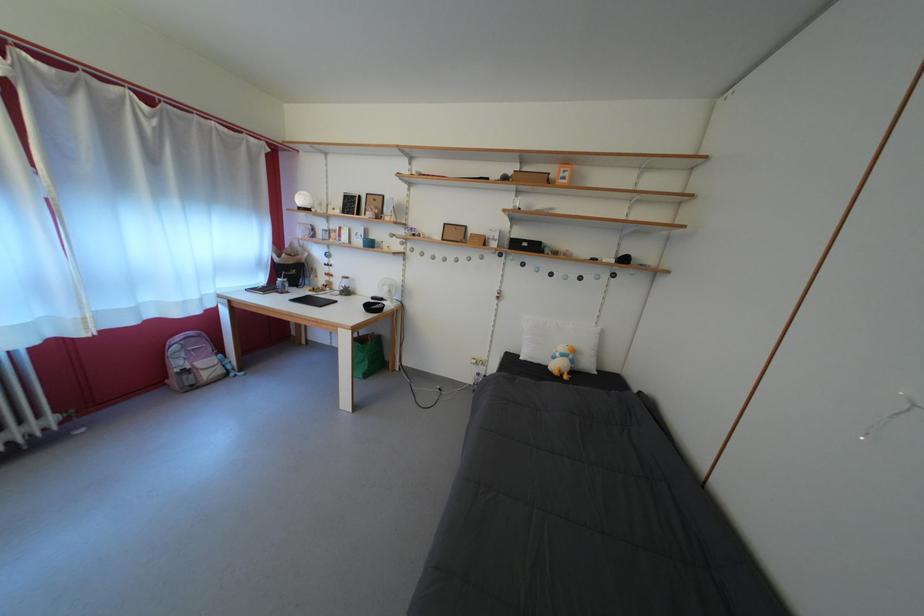
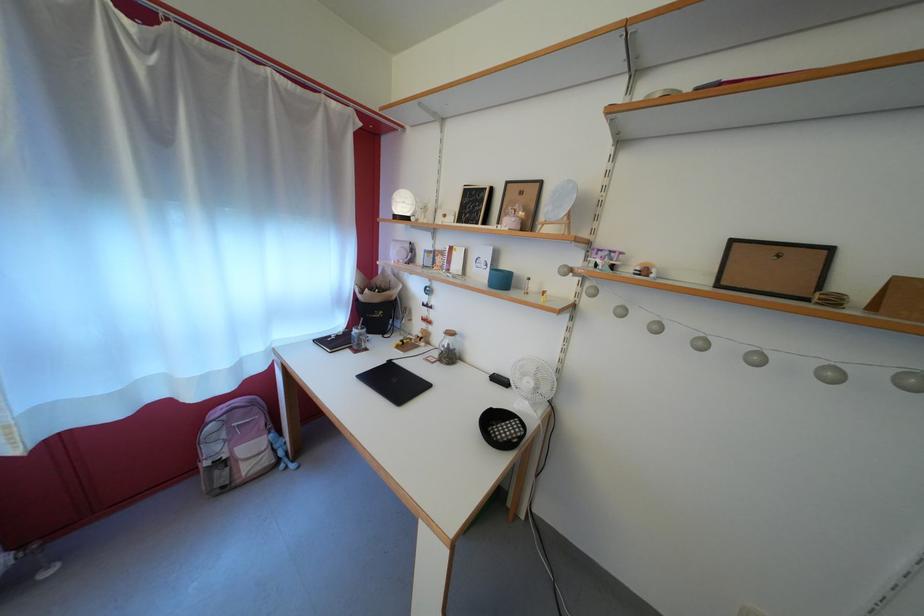
What movement of the cameraman would produce the second image?

The movement direction of the cameraman is left, forward.